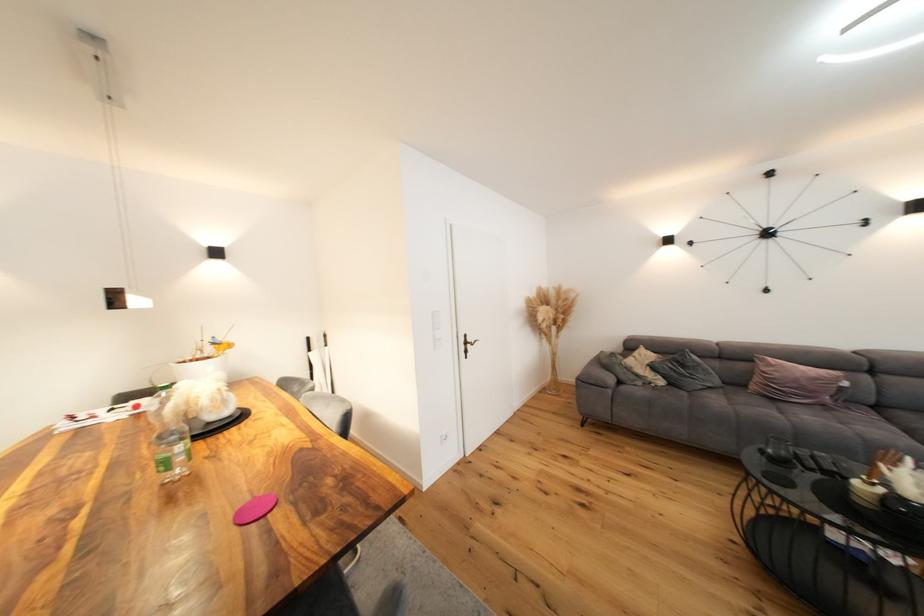
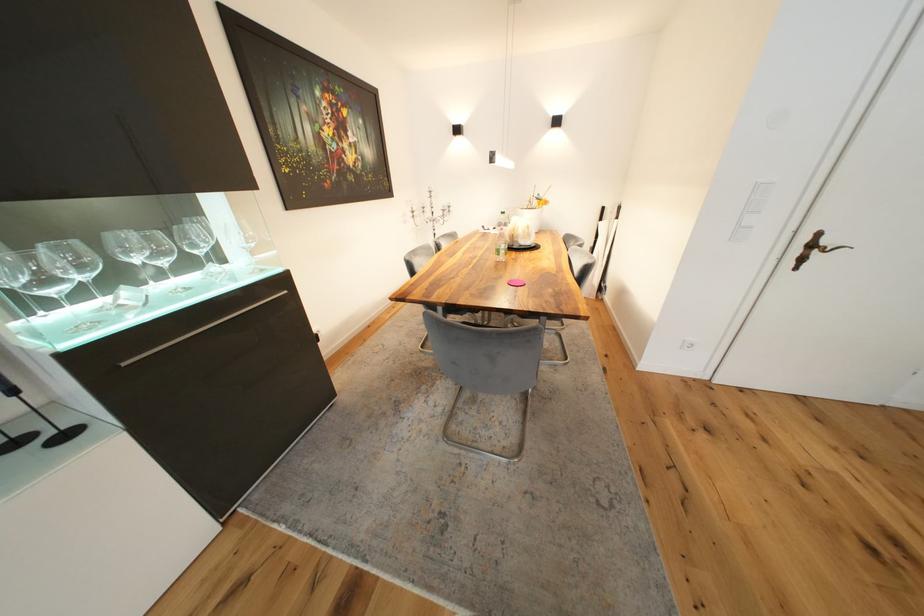
The first image is from the beginning of the video and the second image is from the end. How did the camera likely rotate when shooting the video?

The camera's rotation is toward left-down.